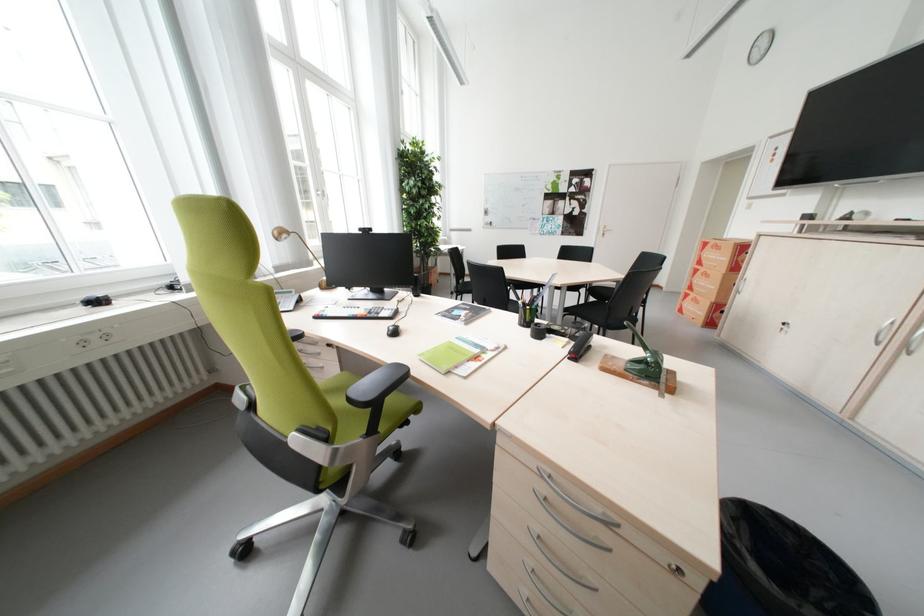
Where would you sit the green chair sitting surface? Please return your answer as a coordinate pair (x, y).

(335, 399)